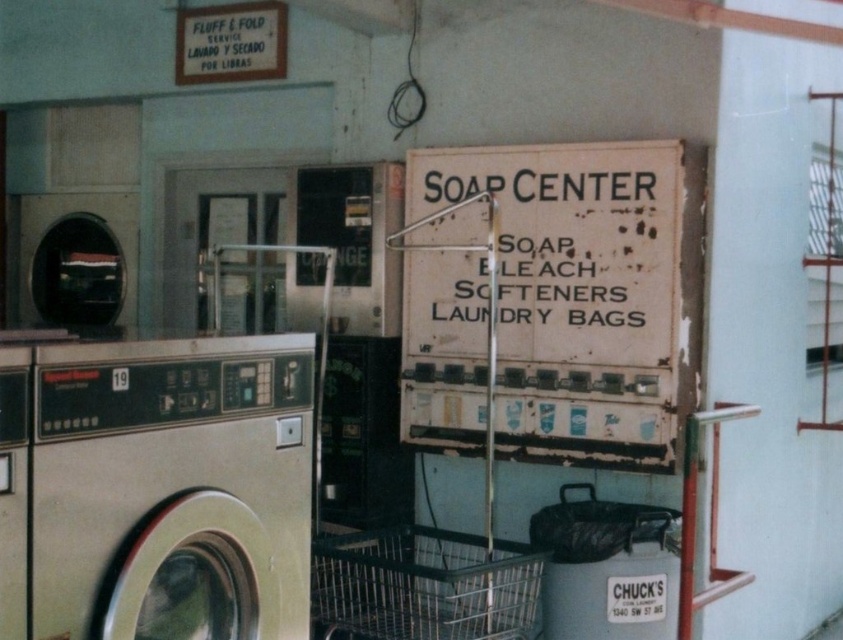
What is the location of the point with coordinates (550, 298) in the laundromat scene?

The point with coordinates (550, 298) is located on the worn paper sign at center.

You are standing in the laundromat and need to read the worn paper sign at center. Can you see the entire sign without moving closer, considering the metallic silver washing machine at left is in front of you?

The worn paper sign at center is much taller than the metallic silver washing machine at left, so yes, you can see the entire sign without moving closer because it extends higher than the washing machine.

You are standing in the laundromat and want to place the metallic wire laundry basket at lower center next to the metallic silver washing machine at left. Can you walk directly between them to move the basket?

The metallic silver washing machine at left is closer to the viewer than the metallic wire laundry basket at lower center, so you can walk directly between them to move the basket.